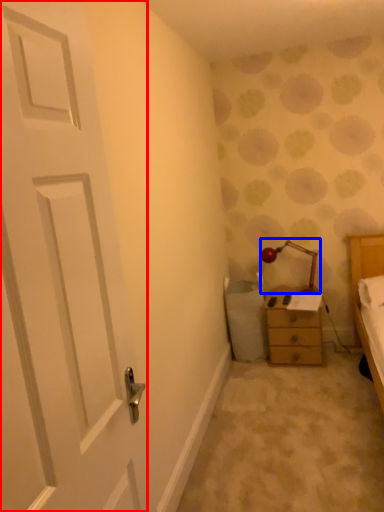
Question: Among these objects, which one is farthest to the camera, door (highlighted by a red box) or lamp (highlighted by a blue box)?

Choices:
 (A) door
 (B) lamp

Answer: (B)